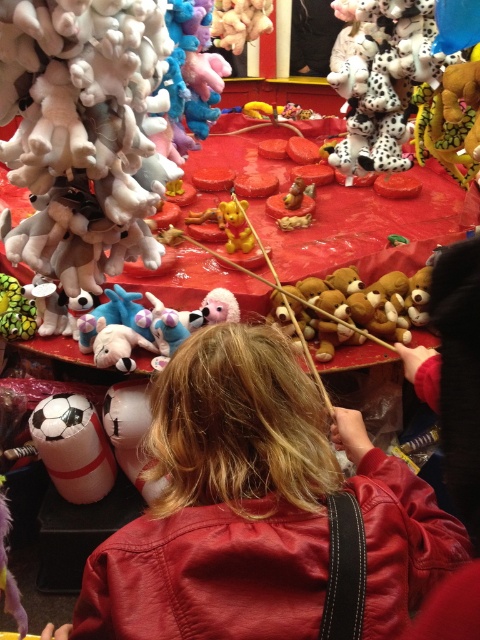
You are a carnival worker checking the claw machine. You notice the leather jacket at center and the soft plush teddy bear at center. Which object is located above the other?

The soft plush teddy bear at center is above the leather jacket at center because the leather jacket at center is positioned under it.

You are a photographer positioned at the edge of the carnival, and you want to take a photo of the white matte soccer ball at lower left without the leather jacket at center blocking the view. Which direction should you move to ensure the soccer ball is visible and the jacket is out of frame?

Move to the left side so that the white matte soccer ball at lower left is visible and the leather jacket at center is no longer blocking the view since the jacket is to the right of the soccer ball.

You are a photographer trying to capture a clear shot of the leather jacket at center and the soft plush teddy bear at center. Since both are in the same frame, which one would you focus on first to ensure it appears sharp in the photo?

The leather jacket at center is larger in size than the soft plush teddy bear at center, so focusing on the larger object first would ensure it appears sharp. Once focused, the smaller object should also be in acceptable focus due to depth of field.